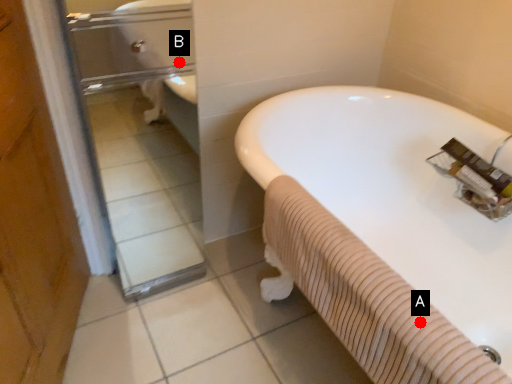
Question: Two points are circled on the image, labeled by A and B beside each circle. Which point appears closest to the camera in this image?

Choices:
 (A) A is closer
 (B) B is closer

Answer: (A)